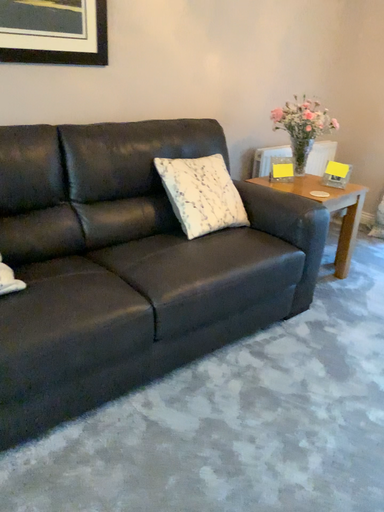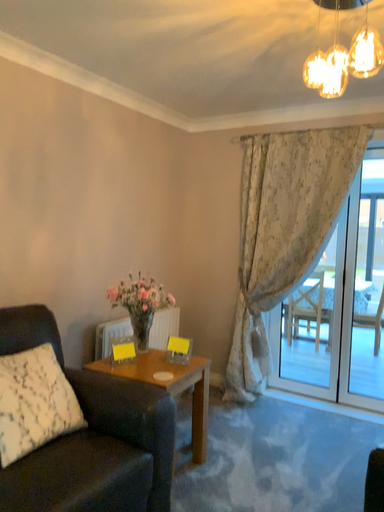
Question: How did the camera likely rotate when shooting the video?

Choices:
 (A) rotated right
 (B) rotated left

Answer: (A)